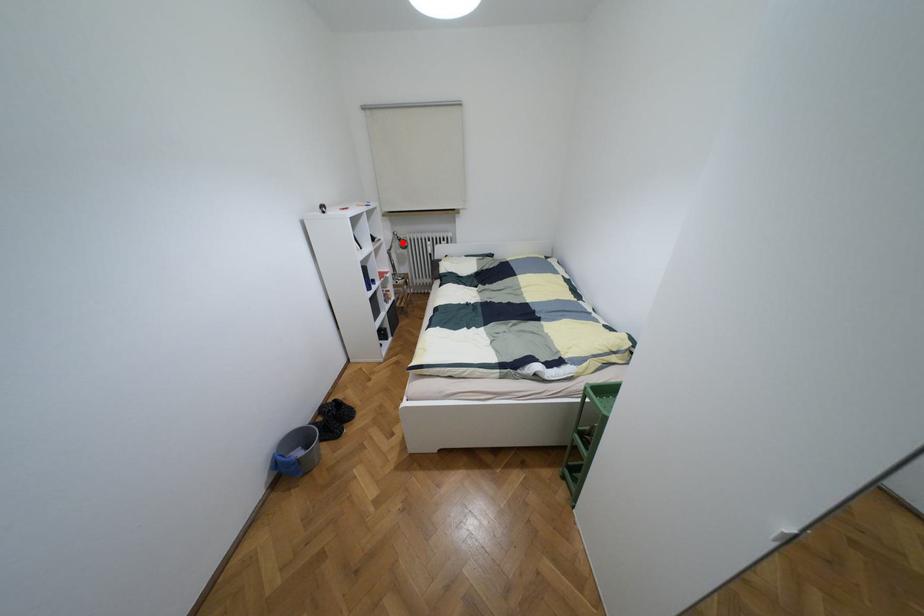
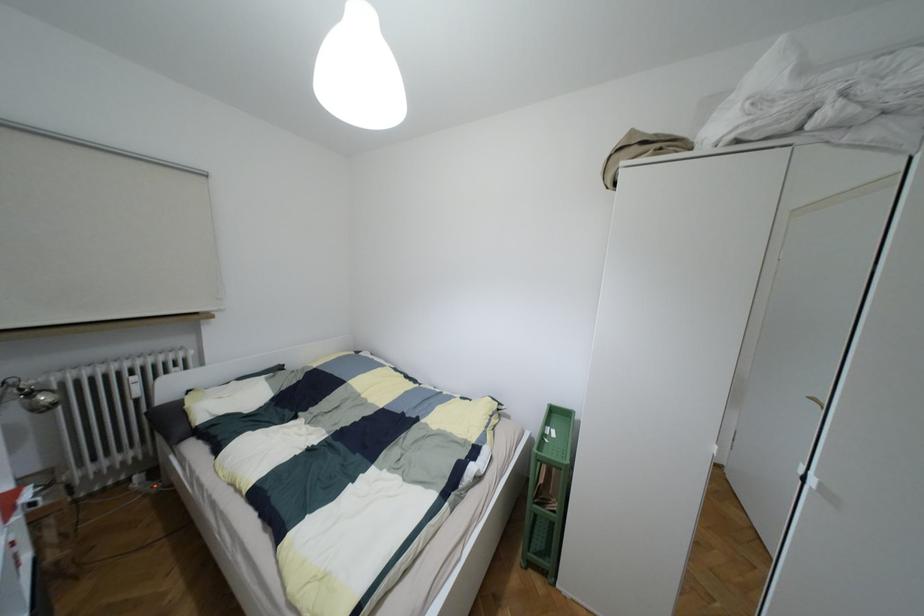
Question: A red point is marked in image1. In image2, is the corresponding 3D point closer to the camera or farther? Reply with the corresponding letter.

Choices:
 (A) The corresponding 3D point is closer.
 (B) The corresponding 3D point is farther.

Answer: (B)